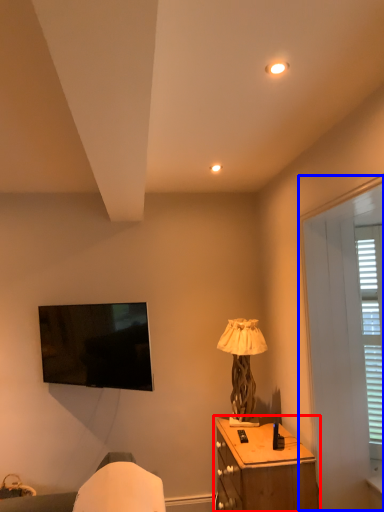
Question: Which object appears closest to the camera in this image, nightstand (highlighted by a red box) or screen door (highlighted by a blue box)?

Choices:
 (A) nightstand
 (B) screen door

Answer: (B)